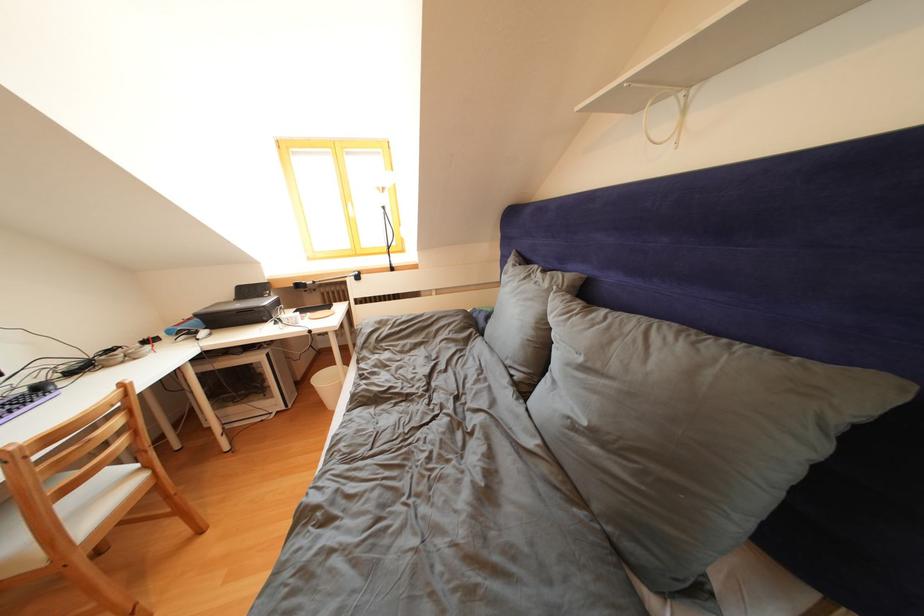
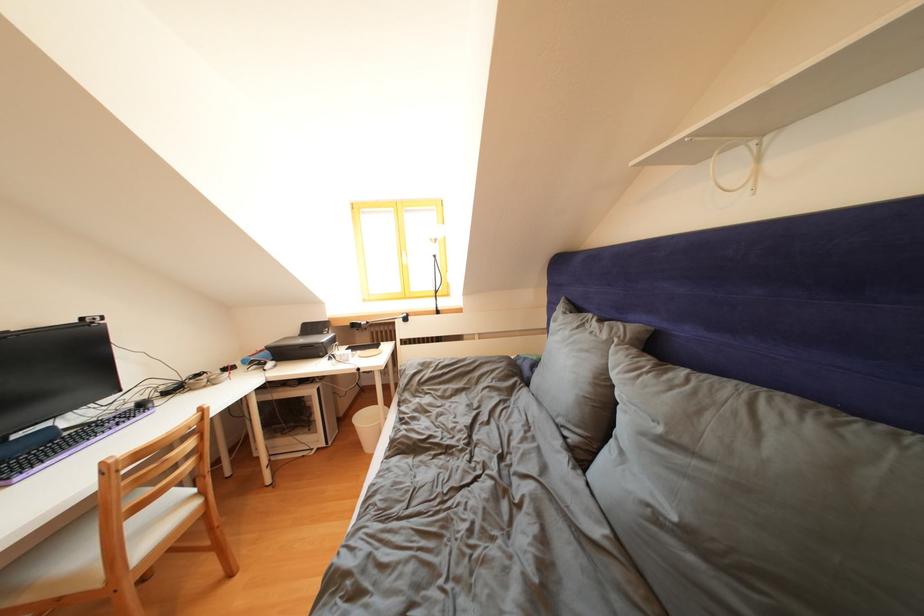
Where in the second image is the point corresponding to the point at 590,363 from the first image?

(667, 435)